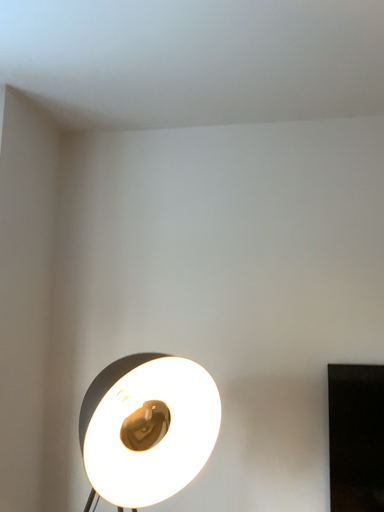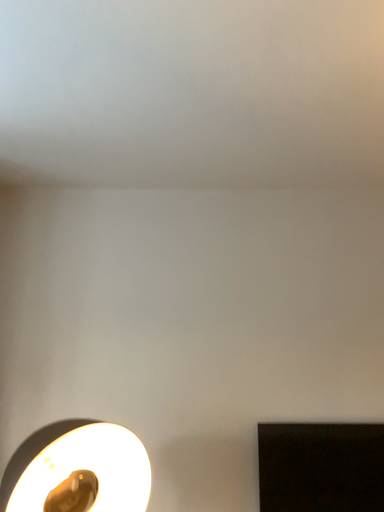
Question: Which way did the camera rotate in the video?

Choices:
 (A) rotated left
 (B) rotated right

Answer: (B)